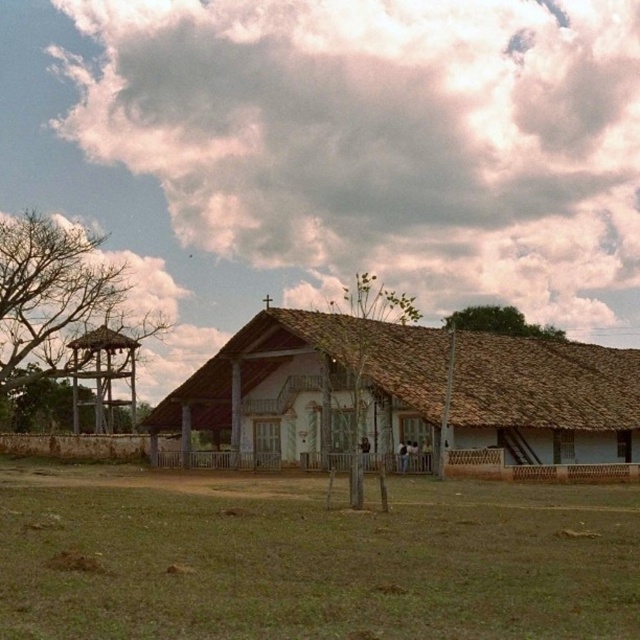
Question: Does green leafy tree at center appear under green leafy tree at upper center?

Choices:
 (A) yes
 (B) no

Answer: (A)

Question: Among these points, which one is nearest to the camera?

Choices:
 (A) (461, 573)
 (B) (100, 260)
 (C) (300, 326)

Answer: (A)

Question: Where is wooden lattice gazebo at left located in relation to green leafy tree at upper center in the image?

Choices:
 (A) below
 (B) above

Answer: (A)

Question: Does bare wood tree at left come in front of green leafy tree at upper center?

Choices:
 (A) yes
 (B) no

Answer: (A)

Question: Among these points, which one is nearest to the camera?

Choices:
 (A) (161, 412)
 (B) (182, 627)
 (C) (90, 252)

Answer: (B)

Question: Which object is positioned closest to the bare wood tree at left?

Choices:
 (A) green grass at center
 (B) green leafy tree at upper center
 (C) green leafy tree at center

Answer: (C)